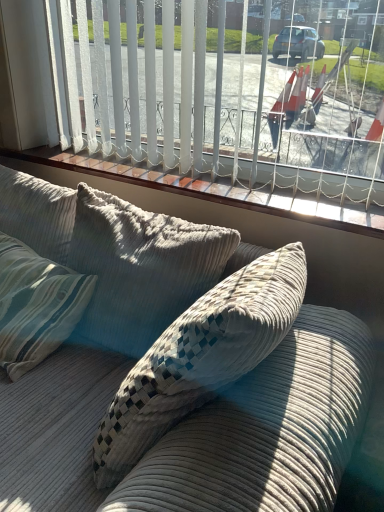
Question: Is point (193, 177) closer or farther from the camera than point (112, 379)?

Choices:
 (A) closer
 (B) farther

Answer: (B)

Question: Is white vertical blinds at upper center to the left or to the right of corduroy couch at center in the image?

Choices:
 (A) left
 (B) right

Answer: (A)

Question: Based on their relative distances, which object is nearer to the wooden window sill at upper center?

Choices:
 (A) white vertical blinds at upper center
 (B) corduroy couch at center

Answer: (A)

Question: Which object is the closest to the corduroy couch at center?

Choices:
 (A) wooden window sill at upper center
 (B) white vertical blinds at upper center

Answer: (A)